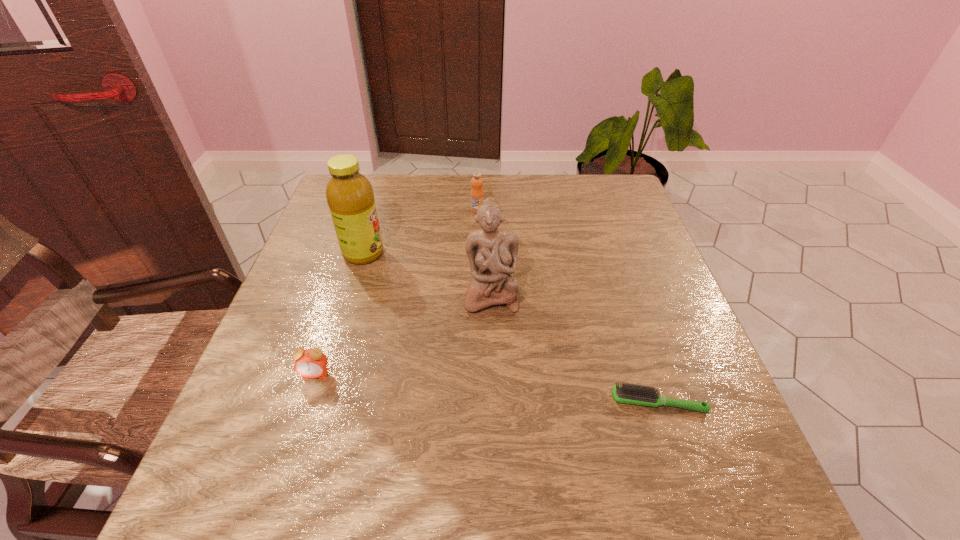
What are the coordinates of `vacant space that is in between the orange juice and the rightmost object` in the screenshot? It's located at (567, 306).

Identify the location of free space between the third tallest object and the fourth nearest object. This screenshot has height=540, width=960. (420, 232).

Where is `object that stands as the closest to the fourth nearest object`? The width and height of the screenshot is (960, 540). object that stands as the closest to the fourth nearest object is located at coordinates (492, 252).

Where is `the closest object to the fruit juice`? The image size is (960, 540). the closest object to the fruit juice is located at coordinates (492, 252).

This screenshot has height=540, width=960. What are the coordinates of `free space that satisfies the following two spatial constraints: 1. on the front label of the nearest object; 2. on the right side of the second farthest object` in the screenshot? It's located at (319, 402).

You are a GUI agent. You are given a task and a screenshot of the screen. Output one action in this format:
    pyautogui.click(x=<x>, y=<y>)
    Task: Click on the vacant space that satisfies the following two spatial constraints: 1. on the front label of the orange juice; 2. on the left side of the rightmost object
    Image resolution: width=960 pixels, height=540 pixels.
    Given the screenshot: What is the action you would take?
    pyautogui.click(x=476, y=402)

Identify the location of free space that satisfies the following two spatial constraints: 1. on the front-facing side of the figurine; 2. on the left side of the rightmost object. (493, 402).

What are the coordinates of `free point that satisfies the following two spatial constraints: 1. on the front label of the third shortest object; 2. on the left side of the nearest object` in the screenshot? It's located at (476, 402).

You are a GUI agent. You are given a task and a screenshot of the screen. Output one action in this format:
    pyautogui.click(x=<x>, y=<y>)
    Task: Click on the free spot that satisfies the following two spatial constraints: 1. on the face of the alarm clock; 2. on the right side of the shortest object
    The image size is (960, 540).
    Given the screenshot: What is the action you would take?
    pyautogui.click(x=306, y=402)

You are a GUI agent. You are given a task and a screenshot of the screen. Output one action in this format:
    pyautogui.click(x=<x>, y=<y>)
    Task: Click on the free space that satisfies the following two spatial constraints: 1. on the front label of the rightmost object; 2. on the right side of the fourth nearest object
    
    Given the screenshot: What is the action you would take?
    pyautogui.click(x=319, y=402)